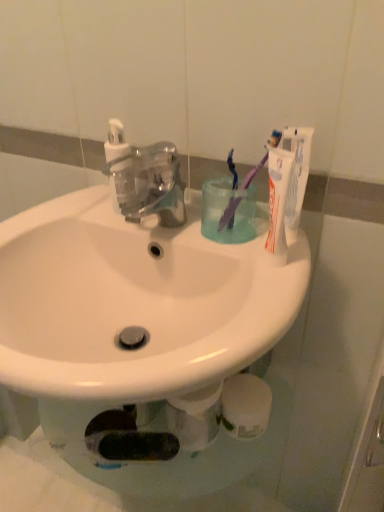
Question: From the image's perspective, would you say translucent plastic cup at center is positioned over white matte toothpaste at upper right?

Choices:
 (A) no
 (B) yes

Answer: (A)

Question: Considering the relative positions of translucent plastic cup at center and white matte toothpaste at upper right in the image provided, is translucent plastic cup at center behind white matte toothpaste at upper right?

Choices:
 (A) yes
 (B) no

Answer: (A)

Question: Is translucent plastic cup at center positioned beyond the bounds of white matte toothpaste at upper right?

Choices:
 (A) yes
 (B) no

Answer: (A)

Question: Is translucent plastic cup at center thinner than white matte toothpaste at upper right?

Choices:
 (A) yes
 (B) no

Answer: (B)

Question: Considering the relative sizes of translucent plastic cup at center and white matte toothpaste at upper right in the image provided, is translucent plastic cup at center taller than white matte toothpaste at upper right?

Choices:
 (A) no
 (B) yes

Answer: (A)

Question: Is white glossy sink at center wider or thinner than transparent plastic faucet at center?

Choices:
 (A) thin
 (B) wide

Answer: (B)

Question: Is white glossy sink at center to the left or to the right of transparent plastic faucet at center in the image?

Choices:
 (A) right
 (B) left

Answer: (B)

Question: From a real-world perspective, is white glossy sink at center physically located above or below transparent plastic faucet at center?

Choices:
 (A) above
 (B) below

Answer: (B)

Question: Based on their sizes in the image, would you say white glossy sink at center is bigger or smaller than transparent plastic faucet at center?

Choices:
 (A) small
 (B) big

Answer: (B)

Question: Is point (261, 308) positioned closer to the camera than point (210, 203)?

Choices:
 (A) closer
 (B) farther

Answer: (A)

Question: From a real-world perspective, is white glossy sink at center above or below translucent plastic cup at center?

Choices:
 (A) above
 (B) below

Answer: (B)

Question: Considering the positions of white glossy sink at center and translucent plastic cup at center in the image, is white glossy sink at center taller or shorter than translucent plastic cup at center?

Choices:
 (A) short
 (B) tall

Answer: (B)

Question: Based on their sizes in the image, would you say white glossy sink at center is bigger or smaller than translucent plastic cup at center?

Choices:
 (A) big
 (B) small

Answer: (A)

Question: Is transparent plastic faucet at center taller or shorter than white glossy sink at center?

Choices:
 (A) short
 (B) tall

Answer: (A)

Question: From the image's perspective, is transparent plastic faucet at center located above or below white glossy sink at center?

Choices:
 (A) above
 (B) below

Answer: (A)